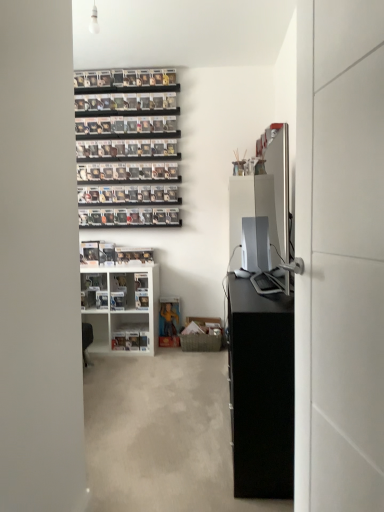
Question: Does satin silver desktop at center appear on the right side of white glossy shelf at center, which appears as the second shelf when ordered from the bottom?

Choices:
 (A) yes
 (B) no

Answer: (A)

Question: Considering the relative positions of satin silver desktop at center and white glossy shelf at center, which appears as the second shelf when ordered from the bottom, in the image provided, is satin silver desktop at center behind white glossy shelf at center, which appears as the second shelf when ordered from the bottom,?

Choices:
 (A) yes
 (B) no

Answer: (B)

Question: Considering the relative sizes of satin silver desktop at center and white glossy shelf at center, which appears as the second shelf when ordered from the bottom, in the image provided, is satin silver desktop at center taller than white glossy shelf at center, which appears as the second shelf when ordered from the bottom,?

Choices:
 (A) yes
 (B) no

Answer: (B)

Question: Is satin silver desktop at center aimed at white glossy shelf at center, which is counted as the first shelf, starting from the top?

Choices:
 (A) yes
 (B) no

Answer: (B)

Question: Is satin silver desktop at center at the left side of white glossy shelf at center, which appears as the second shelf when ordered from the bottom?

Choices:
 (A) yes
 (B) no

Answer: (B)

Question: Can white glossy shelf at center, which is counted as the first shelf, starting from the top, be found inside satin silver desktop at center?

Choices:
 (A) yes
 (B) no

Answer: (B)

Question: Can you confirm if white glossy door at right is taller than satin silver desktop at center?

Choices:
 (A) no
 (B) yes

Answer: (B)

Question: From a real-world perspective, is white glossy door at right over satin silver desktop at center?

Choices:
 (A) yes
 (B) no

Answer: (A)

Question: Is white glossy door at right positioned behind satin silver desktop at center?

Choices:
 (A) yes
 (B) no

Answer: (B)

Question: Is white glossy door at right completely or partially outside of satin silver desktop at center?

Choices:
 (A) no
 (B) yes

Answer: (B)

Question: Can you confirm if white glossy door at right is smaller than satin silver desktop at center?

Choices:
 (A) no
 (B) yes

Answer: (A)

Question: From the image's perspective, is white glossy door at right beneath satin silver desktop at center?

Choices:
 (A) no
 (B) yes

Answer: (B)

Question: From the image's perspective, does white plastic shelf at lower center, which appears as the first shelf when ordered from the bottom, appear lower than black matte cabinet at right?

Choices:
 (A) yes
 (B) no

Answer: (A)